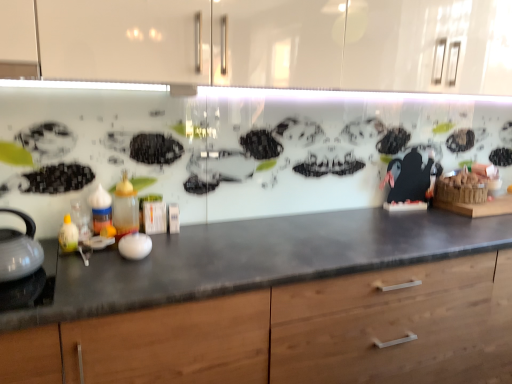
Question: In terms of width, does wooden cabinet at center look wider or thinner when compared to white glossy tea pot at left?

Choices:
 (A) thin
 (B) wide

Answer: (B)

Question: From a real-world perspective, is wooden cabinet at center positioned above or below white glossy tea pot at left?

Choices:
 (A) below
 (B) above

Answer: (A)

Question: Estimate the real-world distances between objects in this image. Which object is farther from the translucent plastic bottle at center, which is the 2th bottle from left to right?

Choices:
 (A) wooden cabinet at center
 (B) translucent plastic bottle at left, the second bottle from the right
 (C) white glossy tea pot at left

Answer: (A)

Question: Estimate the real-world distances between objects in this image. Which object is closer to the wooden cabinet at center?

Choices:
 (A) white glossy tea pot at left
 (B) translucent plastic bottle at center, which is the 1th bottle from right to left
 (C) translucent plastic bottle at left, placed as the 1th bottle when sorted from left to right

Answer: (A)